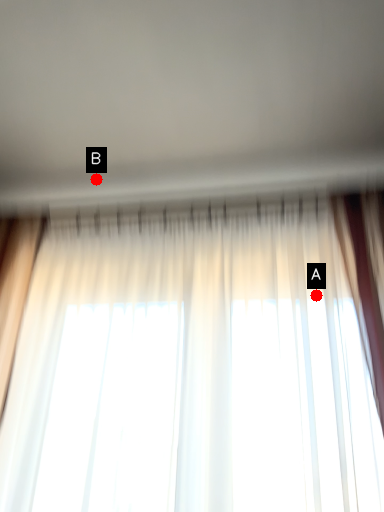
Question: Two points are circled on the image, labeled by A and B beside each circle. Which of the following is the farthest from the observer?

Choices:
 (A) A is further
 (B) B is further

Answer: (B)